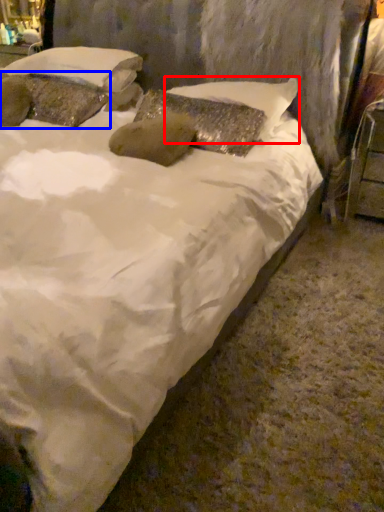
Question: Which object is closer to the camera taking this photo, pillow (highlighted by a red box) or pillow (highlighted by a blue box)?

Choices:
 (A) pillow
 (B) pillow

Answer: (A)